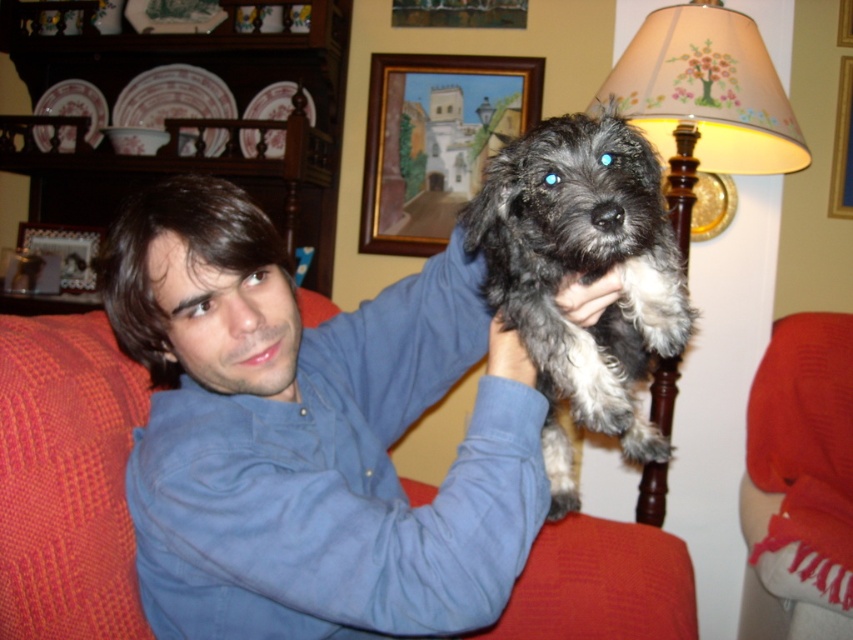
This screenshot has width=853, height=640. What do you see at coordinates (582, 276) in the screenshot?
I see `shaggy gray fur at center` at bounding box center [582, 276].

Can you confirm if shaggy gray fur at center is taller than matte beige lampshade at upper right?

No.

Which is behind, point (653, 157) or point (741, 33)?

The point (741, 33) is more distant.

Find the location of a particular element. shaggy gray fur at center is located at coordinates (582, 276).

Is shaggy gray fur at center bigger than wooden picture frame at upper left?

Yes, shaggy gray fur at center is bigger than wooden picture frame at upper left.

Between point (670, 445) and point (45, 234), which one is positioned behind?

Point (45, 234)

Which is in front, point (575, 496) or point (68, 253)?

Positioned in front is point (575, 496).

Where is `shaggy gray fur at center`? The width and height of the screenshot is (853, 640). shaggy gray fur at center is located at coordinates (582, 276).

Measure the distance between velvet red couch at center and matte beige lampshade at upper right.

velvet red couch at center is 1.27 meters away from matte beige lampshade at upper right.

Describe the element at coordinates (67, 480) in the screenshot. The height and width of the screenshot is (640, 853). I see `velvet red couch at center` at that location.

The image size is (853, 640). What are the coordinates of `velvet red couch at center` in the screenshot? It's located at (67, 480).